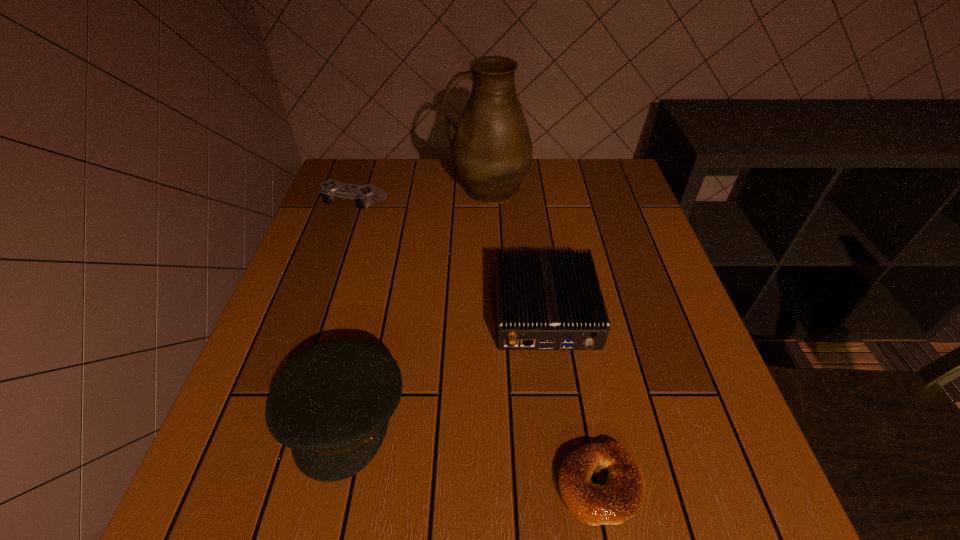
At what (x,y) coordinates should I click in order to perform the action: click on pitcher. Please return your answer as a coordinate pair (x, y). This screenshot has height=540, width=960. Looking at the image, I should click on (491, 147).

Identify the location of beret. (331, 405).

Locate an element on the screen. The width and height of the screenshot is (960, 540). router is located at coordinates pos(545,300).

Locate an element on the screen. This screenshot has height=540, width=960. the third shortest object is located at coordinates (545, 300).

Find the location of a particular element. the fourth tallest object is located at coordinates (365, 195).

Find the location of a particular element. Image resolution: width=960 pixels, height=540 pixels. bagel is located at coordinates coord(621,497).

Find the location of `vacant space located on the handle side of the tallest object`. vacant space located on the handle side of the tallest object is located at coordinates (385, 188).

Find the location of a particular element. The height and width of the screenshot is (540, 960). vacant position located on the handle side of the tallest object is located at coordinates (361, 188).

Where is `free region located 0.240m on the handle side of the tallest object`? Image resolution: width=960 pixels, height=540 pixels. free region located 0.240m on the handle side of the tallest object is located at coordinates (361, 188).

Identify the location of free space located on the back panel of the router. The width and height of the screenshot is (960, 540). (572, 508).